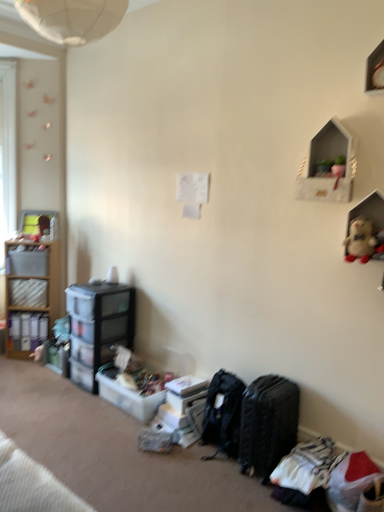
The height and width of the screenshot is (512, 384). Identify the location of plastic storage box at lower center, the 1th storage box viewed from the right. (184, 400).

The height and width of the screenshot is (512, 384). In order to click on matte plastic storage box at left, marked as the third storage box in a bottom-to-top arrangement in this screenshot , I will do `click(28, 293)`.

Describe the element at coordinates (128, 396) in the screenshot. I see `translucent plastic storage box at lower center, the fourth storage box in the top-to-bottom sequence` at that location.

Where is `translucent plastic storage box at lower center, which is the first storage box in bottom-to-top order`? translucent plastic storage box at lower center, which is the first storage box in bottom-to-top order is located at coordinates (128, 396).

What is the approximate height of black textured suitcase at lower right?

black textured suitcase at lower right is 20.30 inches in height.

Where is `transparent plastic storage at lower left, the 2th shelf from the left`? This screenshot has height=512, width=384. transparent plastic storage at lower left, the 2th shelf from the left is located at coordinates (98, 327).

Identify the location of white matte shelf at upper right, the 1th shelf in the right-to-left sequence. (328, 166).

Locate an element on the screen. matte black storage box at left, which is the second storage box from left to right is located at coordinates (28, 262).

Measure the distance from white matte shelf at upper right, the 1th shelf in the right-to-left sequence, to matte plastic shelves at left, arranged as the 3th shelf when viewed from the front.

The distance of white matte shelf at upper right, the 1th shelf in the right-to-left sequence, from matte plastic shelves at left, arranged as the 3th shelf when viewed from the front, is 2.52 meters.

Is point (319, 175) closer or farther from the camera than point (39, 337)?

Point (319, 175) is closer to the camera than point (39, 337).

Could you tell me if white matte shelf at upper right, acting as the 3th shelf starting from the left, is turned towards matte plastic shelves at left, which appears as the 1th shelf when viewed from the back?

No, white matte shelf at upper right, acting as the 3th shelf starting from the left, is not oriented towards matte plastic shelves at left, which appears as the 1th shelf when viewed from the back.

Between white matte shelf at upper right, which appears as the 1th shelf when viewed from the front, and matte plastic shelves at left, arranged as the 3th shelf when viewed from the front, which one has larger width?

With larger width is matte plastic shelves at left, arranged as the 3th shelf when viewed from the front.

Is matte plastic shelves at left, which is counted as the 3th shelf, starting from the right, at the back of plastic storage box at lower center, the 2th storage box when ordered from bottom to top?

That's not correct — plastic storage box at lower center, the 2th storage box when ordered from bottom to top, is not looking away from matte plastic shelves at left, which is counted as the 3th shelf, starting from the right.

Is matte plastic shelves at left, arranged as the 3th shelf when viewed from the front, surrounded by plastic storage box at lower center, the 1th storage box viewed from the right?

Definitely not — matte plastic shelves at left, arranged as the 3th shelf when viewed from the front, is not inside plastic storage box at lower center, the 1th storage box viewed from the right.

Consider the image. From the image's perspective, is plastic storage box at lower center, the 2th storage box when ordered from bottom to top, located above or below matte plastic shelves at left, positioned as the first shelf in left-to-right order?

Based on their image positions, plastic storage box at lower center, the 2th storage box when ordered from bottom to top, is located beneath matte plastic shelves at left, positioned as the first shelf in left-to-right order.

Would you consider plastic storage box at lower center, the third storage box positioned from the top, to be distant from matte plastic shelves at left, arranged as the 3th shelf when viewed from the front?

Yes.

From a real-world perspective, is fluffy beige stuffed animal at upper right physically below transparent plastic storage at lower left, the second shelf viewed from the back?

No, from a real-world perspective, fluffy beige stuffed animal at upper right is not beneath transparent plastic storage at lower left, the second shelf viewed from the back.

Locate an element on the screen. toy that appears in front of the transparent plastic storage at lower left, which is counted as the 2th shelf, starting from the right is located at coordinates (360, 240).

From the picture: Considering the relative sizes of fluffy beige stuffed animal at upper right and transparent plastic storage at lower left, which is counted as the 2th shelf, starting from the right, in the image provided, is fluffy beige stuffed animal at upper right smaller than transparent plastic storage at lower left, which is counted as the 2th shelf, starting from the right,?

Yes.

From the picture: Could you tell me if white matte shelf at upper right, acting as the 3th shelf starting from the left, is facing transparent plastic storage at lower left, the 2th shelf from the left?

No, white matte shelf at upper right, acting as the 3th shelf starting from the left, is not turned towards transparent plastic storage at lower left, the 2th shelf from the left.

This screenshot has width=384, height=512. I want to click on the 2nd shelf above the transparent plastic storage at lower left, the 2th shelf viewed from the front (from the image's perspective), so click(328, 166).

Would you say white matte shelf at upper right, which appears as the 1th shelf when viewed from the front, is a long distance from transparent plastic storage at lower left, which is counted as the 2th shelf, starting from the right?

white matte shelf at upper right, which appears as the 1th shelf when viewed from the front, is far away from transparent plastic storage at lower left, which is counted as the 2th shelf, starting from the right.

In the scene shown: From the image's perspective, is white matte shelf at upper right, acting as the 3th shelf starting from the left, located beneath transparent plastic storage at lower left, the second shelf viewed from the back?

No.

Is matte black storage box at left, which ranks as the first storage box in top-to-bottom order, looking in the opposite direction of matte plastic shelves at left, which is counted as the 3th shelf, starting from the right?

Yes.

Which object is further away from the camera, matte black storage box at left, which is the second storage box from left to right, or matte plastic shelves at left, which is counted as the 3th shelf, starting from the right?

matte black storage box at left, which is the second storage box from left to right, is more distant.

How different are the orientations of matte black storage box at left, which is the second storage box from left to right, and matte plastic shelves at left, which appears as the 1th shelf when viewed from the back, in degrees?

→ The angle between the facing direction of matte black storage box at left, which is the second storage box from left to right, and the facing direction of matte plastic shelves at left, which appears as the 1th shelf when viewed from the back, is 0.631 degrees.

From the picture: Is matte black storage box at left, marked as the fourth storage box in a bottom-to-top arrangement, taller than matte plastic shelves at left, arranged as the 3th shelf when viewed from the front?

No, matte black storage box at left, marked as the fourth storage box in a bottom-to-top arrangement, is not taller than matte plastic shelves at left, arranged as the 3th shelf when viewed from the front.

Is the depth of translucent plastic storage box at lower center, which is the 3th storage box from left to right, greater than that of matte plastic storage box at left, which is the second storage box in top-to-bottom order?

No, translucent plastic storage box at lower center, which is the 3th storage box from left to right, is closer to the viewer.

Could you tell me if translucent plastic storage box at lower center, which is the 2th storage box in right-to-left order, is turned towards matte plastic storage box at left, marked as the third storage box in a bottom-to-top arrangement?

No, translucent plastic storage box at lower center, which is the 2th storage box in right-to-left order, is not turned towards matte plastic storage box at left, marked as the third storage box in a bottom-to-top arrangement.

Between translucent plastic storage box at lower center, which is the first storage box in bottom-to-top order, and matte plastic storage box at left, arranged as the first storage box when viewed from the left, which one has more height?

matte plastic storage box at left, arranged as the first storage box when viewed from the left.

Which object is positioned more to the right, matte black storage box at left, acting as the 3th storage box starting from the right, or fluffy beige stuffed animal at upper right?

Positioned to the right is fluffy beige stuffed animal at upper right.

Is matte black storage box at left, which is the second storage box from left to right, taller than fluffy beige stuffed animal at upper right?

No, matte black storage box at left, which is the second storage box from left to right, is not taller than fluffy beige stuffed animal at upper right.

Consider the image. From the image's perspective, is matte black storage box at left, acting as the 3th storage box starting from the right, on fluffy beige stuffed animal at upper right?

No, from the image's perspective, matte black storage box at left, acting as the 3th storage box starting from the right, is not over fluffy beige stuffed animal at upper right.

Is matte black storage box at left, which ranks as the first storage box in top-to-bottom order, in front of or behind fluffy beige stuffed animal at upper right in the image?

Clearly, matte black storage box at left, which ranks as the first storage box in top-to-bottom order, is behind fluffy beige stuffed animal at upper right.

I want to click on the 1st shelf directly beneath the white matte shelf at upper right, which appears as the 1th shelf when viewed from the front (from a real-world perspective), so 32,293.

Image resolution: width=384 pixels, height=512 pixels. Find the location of `shelf that is the 2nd object to the left of the plastic storage box at lower center, the 1th storage box viewed from the right, starting at the anchor`. shelf that is the 2nd object to the left of the plastic storage box at lower center, the 1th storage box viewed from the right, starting at the anchor is located at coordinates (32, 293).

Looking at the image, which one is located further to matte plastic shelves at left, positioned as the first shelf in left-to-right order, fluffy beige stuffed animal at upper right or black textured suitcase at lower right?

fluffy beige stuffed animal at upper right.

Estimate the real-world distances between objects in this image. Which object is closer to matte black storage box at left, which is the second storage box from left to right, fluffy beige stuffed animal at upper right or matte plastic storage box at left, marked as the third storage box in a bottom-to-top arrangement?

matte plastic storage box at left, marked as the third storage box in a bottom-to-top arrangement, lies closer to matte black storage box at left, which is the second storage box from left to right, than the other object.

Based on their spatial positions, is transparent plastic storage at lower left, which is counted as the 2th shelf, starting from the right, or matte plastic shelves at left, positioned as the first shelf in left-to-right order, further from black textured suitcase at lower right?

matte plastic shelves at left, positioned as the first shelf in left-to-right order, lies further to black textured suitcase at lower right than the other object.

Based on their spatial positions, is translucent plastic storage box at lower center, which is the 3th storage box from left to right, or white matte shelf at upper right, the third shelf in the back-to-front sequence, further from plastic storage box at lower center, the third storage box positioned from the top?

white matte shelf at upper right, the third shelf in the back-to-front sequence.

Estimate the real-world distances between objects in this image. Which object is closer to matte black storage box at left, which ranks as the first storage box in top-to-bottom order, matte plastic storage box at left, which is the second storage box in top-to-bottom order, or transparent plastic storage at lower left, the second shelf viewed from the back?

The object closer to matte black storage box at left, which ranks as the first storage box in top-to-bottom order, is matte plastic storage box at left, which is the second storage box in top-to-bottom order.

Considering their positions, is black textured suitcase at lower right positioned further to fluffy beige stuffed animal at upper right than matte plastic shelves at left, arranged as the 3th shelf when viewed from the front?

matte plastic shelves at left, arranged as the 3th shelf when viewed from the front.

Considering their positions, is transparent plastic storage at lower left, the 2th shelf from the left, positioned further to translucent plastic storage box at lower center, which is the first storage box in bottom-to-top order, than matte plastic shelves at left, which is counted as the 3th shelf, starting from the right?

matte plastic shelves at left, which is counted as the 3th shelf, starting from the right, is positioned further to the anchor translucent plastic storage box at lower center, which is the first storage box in bottom-to-top order.

Which object lies further to the anchor point matte plastic shelves at left, positioned as the first shelf in left-to-right order, white matte shelf at upper right, the third shelf in the back-to-front sequence, or plastic storage box at lower center, the 2th storage box when ordered from bottom to top?

white matte shelf at upper right, the third shelf in the back-to-front sequence, lies further to matte plastic shelves at left, positioned as the first shelf in left-to-right order, than the other object.

The image size is (384, 512). I want to click on shelf between matte plastic storage box at left, arranged as the first storage box when viewed from the left, and transparent plastic storage at lower left, which is counted as the 2th shelf, starting from the right, from left to right, so click(32, 293).

Find the location of `shelf situated between matte black storage box at left, acting as the 3th storage box starting from the right, and white matte shelf at upper right, the 1th shelf in the right-to-left sequence, from left to right`. shelf situated between matte black storage box at left, acting as the 3th storage box starting from the right, and white matte shelf at upper right, the 1th shelf in the right-to-left sequence, from left to right is located at coordinates (98, 327).

The height and width of the screenshot is (512, 384). I want to click on shelf situated between matte black storage box at left, which is the second storage box from left to right, and translucent plastic storage box at lower center, the fourth storage box in the top-to-bottom sequence, from left to right, so click(x=98, y=327).

You are a GUI agent. You are given a task and a screenshot of the screen. Output one action in this format:
    pyautogui.click(x=<x>, y=<y>)
    Task: Click on the storage box situated between matte plastic shelves at left, arranged as the 3th shelf when viewed from the front, and transparent plastic storage at lower left, the second shelf viewed from the back, from left to right
    The height and width of the screenshot is (512, 384).
    Given the screenshot: What is the action you would take?
    pyautogui.click(x=28, y=262)